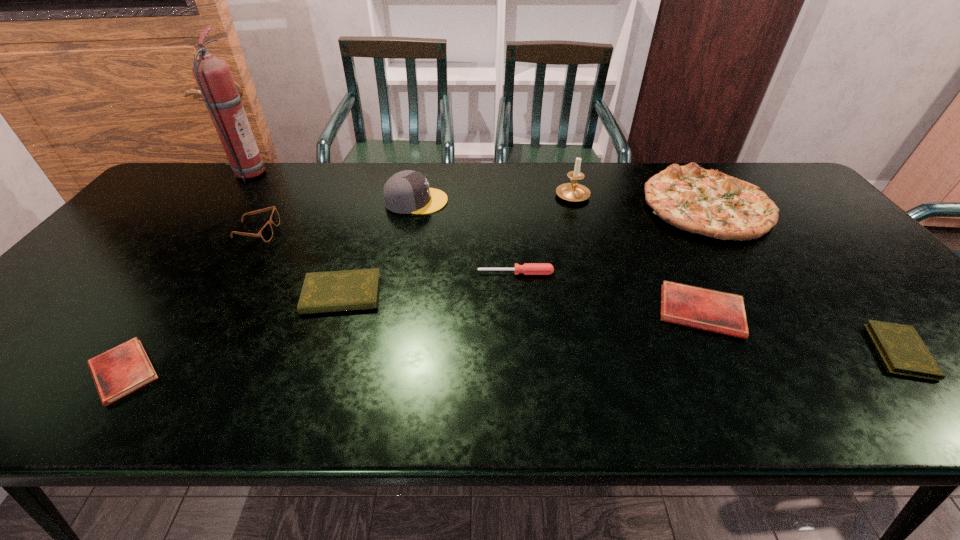
Locate an element on the screen. This screenshot has height=540, width=960. the tallest object is located at coordinates (213, 76).

At what (x,y) coordinates should I click in order to perform the action: click on fire extinguisher. Please return your answer as a coordinate pair (x, y). Image resolution: width=960 pixels, height=540 pixels. Looking at the image, I should click on (213, 76).

Image resolution: width=960 pixels, height=540 pixels. I want to click on beige candle holder, so click(x=573, y=191).

Identify the location of candle holder. (573, 191).

Where is `the eighth shortest object`? the eighth shortest object is located at coordinates 407,191.

The width and height of the screenshot is (960, 540). Find the location of `cap`. cap is located at coordinates (407, 191).

Where is `brown pizza`? The height and width of the screenshot is (540, 960). brown pizza is located at coordinates (707, 202).

Locate an element on the screen. The width and height of the screenshot is (960, 540). the seventh shortest object is located at coordinates (707, 202).

What are the coordinates of `the sixth shortest object` in the screenshot? It's located at (266, 233).

Image resolution: width=960 pixels, height=540 pixels. Identify the location of screwdriver. (528, 268).